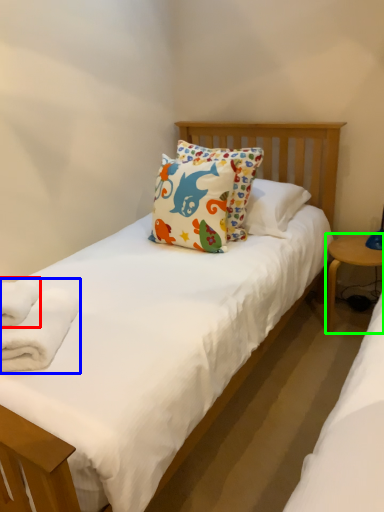
Question: Which object is positioned farthest from bath towel (highlighted by a red box)? Select from bath towel (highlighted by a blue box) and table (highlighted by a green box).

Choices:
 (A) bath towel
 (B) table

Answer: (B)